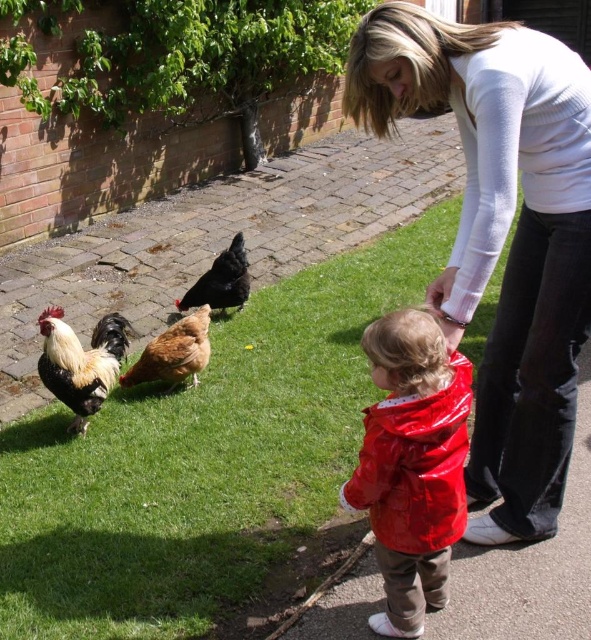
You are a photographer trying to capture the scene of the woman and child with the chickens. You want to ensure the green grass at lower center and the golden brown feathers at center are both visible in your shot. Which object should you focus on to include both in the frame?

Since the green grass at lower center is bigger than the golden brown feathers at center, focusing on the green grass at lower center would allow both objects to fit within the frame as it occupies more space.